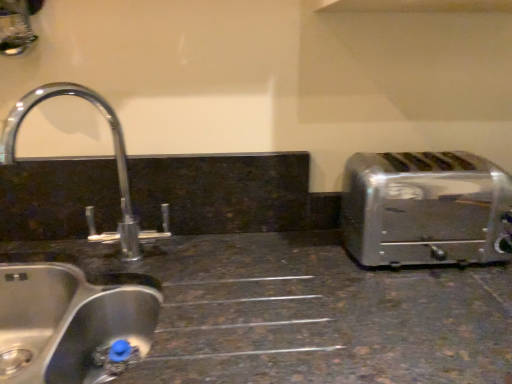
Question: Should I look upward or downward to see satin silver toaster at right?

Choices:
 (A) down
 (B) up

Answer: (A)

Question: Are stainless steel sink at lower left, which is the first sink in bottom-to-top order, and brushed metal sink at left, arranged as the 2th sink when ordered from the bottom, making contact?

Choices:
 (A) yes
 (B) no

Answer: (A)

Question: Is stainless steel sink at lower left, the 2th sink viewed from the top, at the right side of brushed metal sink at left, which is the first sink in top-to-bottom order?

Choices:
 (A) no
 (B) yes

Answer: (A)

Question: Is stainless steel sink at lower left, which is the first sink in bottom-to-top order, further to camera compared to brushed metal sink at left, arranged as the 2th sink when ordered from the bottom?

Choices:
 (A) no
 (B) yes

Answer: (A)

Question: From the image's perspective, is stainless steel sink at lower left, which is the first sink in bottom-to-top order, located above brushed metal sink at left, arranged as the 2th sink when ordered from the bottom?

Choices:
 (A) yes
 (B) no

Answer: (B)

Question: From the image's perspective, would you say stainless steel sink at lower left, the 2th sink viewed from the top, is shown under brushed metal sink at left, which is the first sink in top-to-bottom order?

Choices:
 (A) yes
 (B) no

Answer: (A)

Question: Is stainless steel sink at lower left, which is the first sink in bottom-to-top order, looking in the opposite direction of brushed metal sink at left, which is the first sink in top-to-bottom order?

Choices:
 (A) no
 (B) yes

Answer: (A)

Question: Can you confirm if stainless steel sink at lower left, the 2th sink viewed from the top, is positioned to the right of satin silver toaster at right?

Choices:
 (A) yes
 (B) no

Answer: (B)

Question: Could you tell me if stainless steel sink at lower left, the 2th sink viewed from the top, is turned towards satin silver toaster at right?

Choices:
 (A) yes
 (B) no

Answer: (B)

Question: Is stainless steel sink at lower left, the 2th sink viewed from the top, touching satin silver toaster at right?

Choices:
 (A) yes
 (B) no

Answer: (B)

Question: Is stainless steel sink at lower left, which is the first sink in bottom-to-top order, looking in the opposite direction of satin silver toaster at right?

Choices:
 (A) no
 (B) yes

Answer: (A)

Question: Is stainless steel sink at lower left, the 2th sink viewed from the top, closer to the viewer compared to satin silver toaster at right?

Choices:
 (A) yes
 (B) no

Answer: (A)

Question: From the image's perspective, is stainless steel sink at lower left, which is the first sink in bottom-to-top order, under satin silver toaster at right?

Choices:
 (A) yes
 (B) no

Answer: (A)

Question: Could you tell me if satin silver toaster at right is turned towards brushed metal sink at left, arranged as the 2th sink when ordered from the bottom?

Choices:
 (A) no
 (B) yes

Answer: (A)